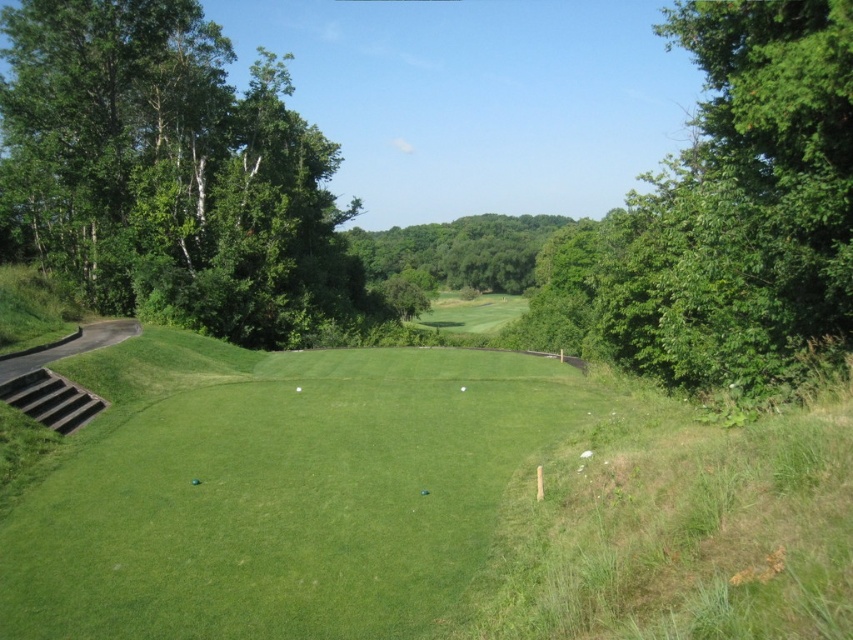
Based on the photo, you are standing at the center of the green lawn and want to head towards the green leafy tree at upper right. Which direction should you walk?

The green leafy tree at upper right is located at point (730, 211), so you should walk towards the upper right direction to reach it.

You are a golfer standing on the green lawn and you see the green leafy tree at upper right and the green matte golf ball at center. Which object is higher in the image?

The green leafy tree at upper right is higher than the green matte golf ball at center in the image.